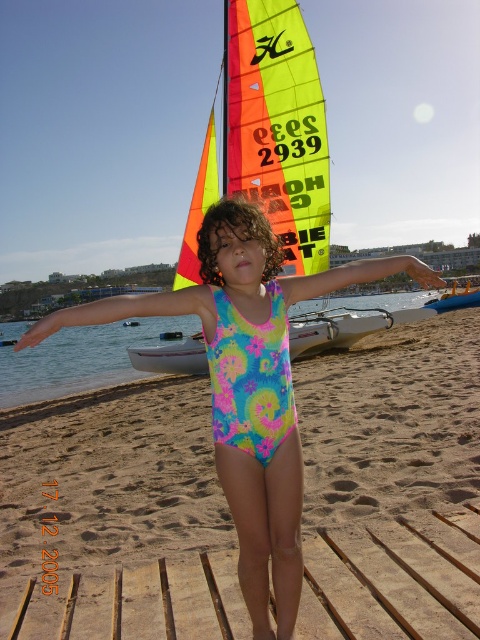
Question: Which of the following is the farthest from the observer?

Choices:
 (A) (459, 294)
 (B) (362, 260)
 (C) (232, 276)

Answer: (A)

Question: Can you confirm if multicolored fabric sailboat at center is thinner than multicolored fabric arm at center?

Choices:
 (A) yes
 (B) no

Answer: (B)

Question: Estimate the real-world distances between objects in this image. Which object is farther from the neon fabric arm at center?

Choices:
 (A) multicolored fabric arm at center
 (B) neon floral swimsuit at center
 (C) multicolored fabric sailboat at center

Answer: (C)

Question: Can you confirm if multicolored fabric sailboat at center is wider than multicolored fabric arm at center?

Choices:
 (A) yes
 (B) no

Answer: (A)

Question: Does multicolored fabric sailboat at center appear on the left side of blue plastic boat at center?

Choices:
 (A) yes
 (B) no

Answer: (A)

Question: Estimate the real-world distances between objects in this image. Which object is closer to the multicolored fabric sailboat at center?

Choices:
 (A) neon fabric arm at center
 (B) blue plastic boat at center
 (C) multicolored fabric arm at center
 (D) neon floral swimsuit at center

Answer: (A)